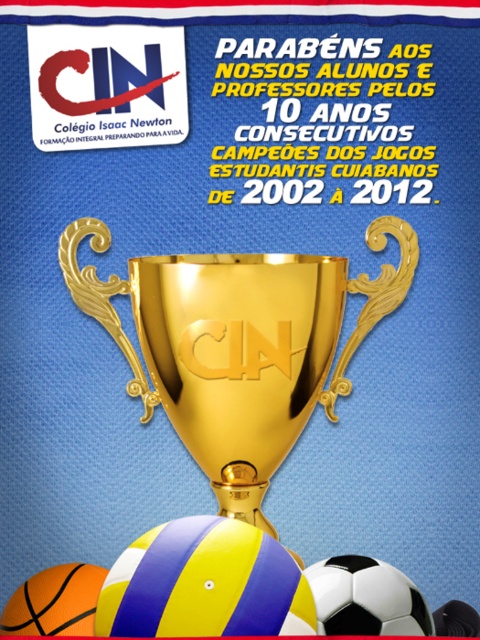
In the celebratory poster for Colggo Isaac Newton, there is a golden trophy with ornate handles and a point labeled at coordinates (x=365, y=598). What object is located at that point?

The point labeled at coordinates (x=365, y=598) is on the white matte beach ball at lower center.

You are a student at Colgico Isaac Newton and you see the celebratory poster with a white matte beach ball at lower center and a yellow matte beach ball at lower center. Which beach ball is more to the right?

The white matte beach ball at lower center is more to the right.

You are designing a poster for Colgelo Isaac Newton and need to place the gold shiny trophy cup at center and the yellow matte beach ball at lower center. The minimum required distance between any two elements on the poster is 12 centimeters for readability. Based on the current placement, will the two elements meet this requirement?

The gold shiny trophy cup at center and yellow matte beach ball at lower center are 10.73 centimeters apart from each other, which is less than the required 12 centimeters. Therefore, the elements do not meet the readability requirement and should be moved further apart.